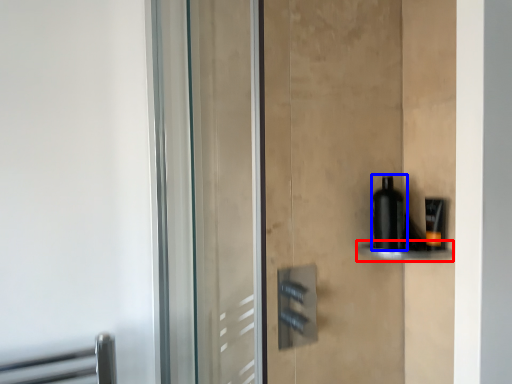
Question: Among these objects, which one is farthest to the camera, shelf (highlighted by a red box) or bottle (highlighted by a blue box)?

Choices:
 (A) shelf
 (B) bottle

Answer: (B)